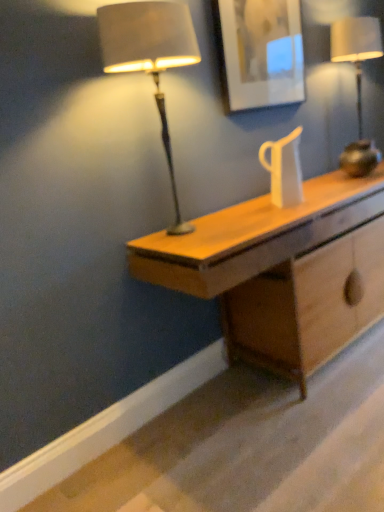
Question: Is matte brown lamp at left, the 2th lamp from the back, thinner than metallic gold lamp at right, acting as the 1th lamp starting from the back?

Choices:
 (A) no
 (B) yes

Answer: (B)

Question: Considering the relative sizes of matte brown lamp at left, the 1th lamp when ordered from front to back, and metallic gold lamp at right, the first lamp positioned from the right, in the image provided, is matte brown lamp at left, the 1th lamp when ordered from front to back, smaller than metallic gold lamp at right, the first lamp positioned from the right,?

Choices:
 (A) yes
 (B) no

Answer: (A)

Question: Does matte brown lamp at left, the 2th lamp from the back, turn towards metallic gold lamp at right, marked as the 2th lamp in a left-to-right arrangement?

Choices:
 (A) yes
 (B) no

Answer: (B)

Question: Does matte brown lamp at left, the 1th lamp when ordered from front to back, have a greater height compared to metallic gold lamp at right, acting as the 1th lamp starting from the back?

Choices:
 (A) yes
 (B) no

Answer: (A)

Question: Is matte brown lamp at left, positioned as the 1th lamp in left-to-right order, in front of metallic gold lamp at right, the second lamp when ordered from front to back?

Choices:
 (A) yes
 (B) no

Answer: (A)

Question: Considering the positions of point (284, 18) and point (173, 53), is point (284, 18) closer or farther from the camera than point (173, 53)?

Choices:
 (A) closer
 (B) farther

Answer: (B)

Question: Considering the relative positions of matte white picture frame at upper center and matte brown lamp at left, placed as the 2th lamp when sorted from right to left, in the image provided, is matte white picture frame at upper center to the left or to the right of matte brown lamp at left, placed as the 2th lamp when sorted from right to left,?

Choices:
 (A) left
 (B) right

Answer: (B)

Question: Considering their positions, is matte white picture frame at upper center located in front of or behind matte brown lamp at left, positioned as the 1th lamp in left-to-right order?

Choices:
 (A) behind
 (B) front

Answer: (A)

Question: From a real-world perspective, relative to matte brown lamp at left, the 2th lamp from the back, is matte white picture frame at upper center vertically above or below?

Choices:
 (A) below
 (B) above

Answer: (B)

Question: In terms of height, does matte white picture frame at upper center look taller or shorter compared to light wood desk at center?

Choices:
 (A) short
 (B) tall

Answer: (A)

Question: From the image's perspective, is matte white picture frame at upper center located above or below light wood desk at center?

Choices:
 (A) below
 (B) above

Answer: (B)

Question: Relative to light wood desk at center, is matte white picture frame at upper center in front or behind?

Choices:
 (A) front
 (B) behind

Answer: (B)

Question: Is matte white picture frame at upper center wider or thinner than light wood desk at center?

Choices:
 (A) wide
 (B) thin

Answer: (B)

Question: Is metallic gold lamp at right, the first lamp positioned from the right, to the left or to the right of matte brown lamp at left, positioned as the 1th lamp in left-to-right order, in the image?

Choices:
 (A) right
 (B) left

Answer: (A)

Question: Considering the positions of metallic gold lamp at right, the first lamp positioned from the right, and matte brown lamp at left, placed as the 2th lamp when sorted from right to left, in the image, is metallic gold lamp at right, the first lamp positioned from the right, bigger or smaller than matte brown lamp at left, placed as the 2th lamp when sorted from right to left,?

Choices:
 (A) small
 (B) big

Answer: (B)